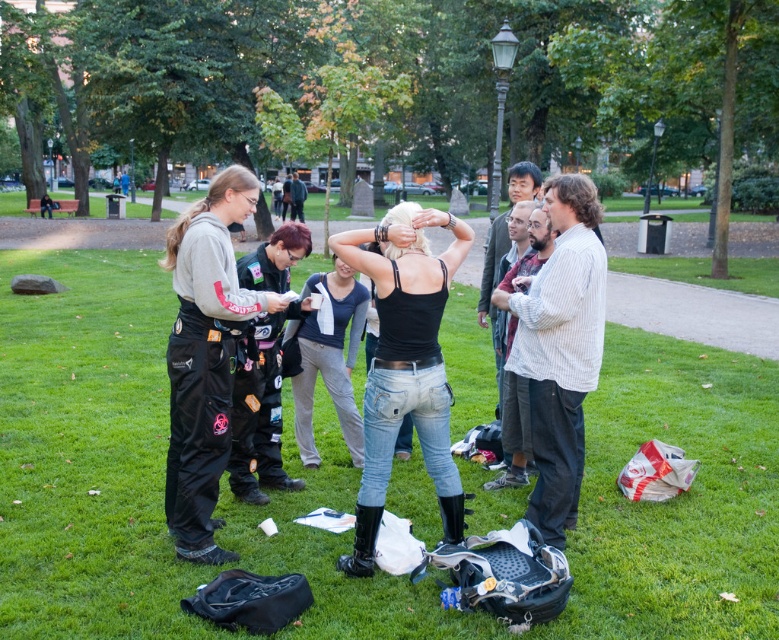
You are a photographer trying to capture a group photo of the people in the park. You notice two clothing items at the center of the scene, the black matte tank top at center and the dark blue jersey at center. Which clothing item should you focus on to ensure it appears more prominent in the photo?

The black matte tank top at center is larger in size than the dark blue jersey at center, so focusing on the black matte tank top at center will make it appear more prominent in the photo.

You are a photographer trying to capture a candid shot of the woman in the black matte tank top at center and the person in the black leather jacket at center. Since you want both subjects to be clearly visible in the frame, does the current arrangement allow you to see both of them fully without any obstruction?

The black matte tank top at center is in front of the black leather jacket at center, so the person in the black leather jacket at center might be partially obscured. To ensure both are visible, adjust your angle to avoid the black matte tank top at center blocking the view.

You are a photographer trying to capture a candid shot of the two central figures in the park scene. The black matte tank top at center and the dark blue jersey at center are both in your frame. Based on their positions, which one is lower in the image?

The black matte tank top at center is below dark blue jersey at center, so the black matte tank top at center is lower in the image.